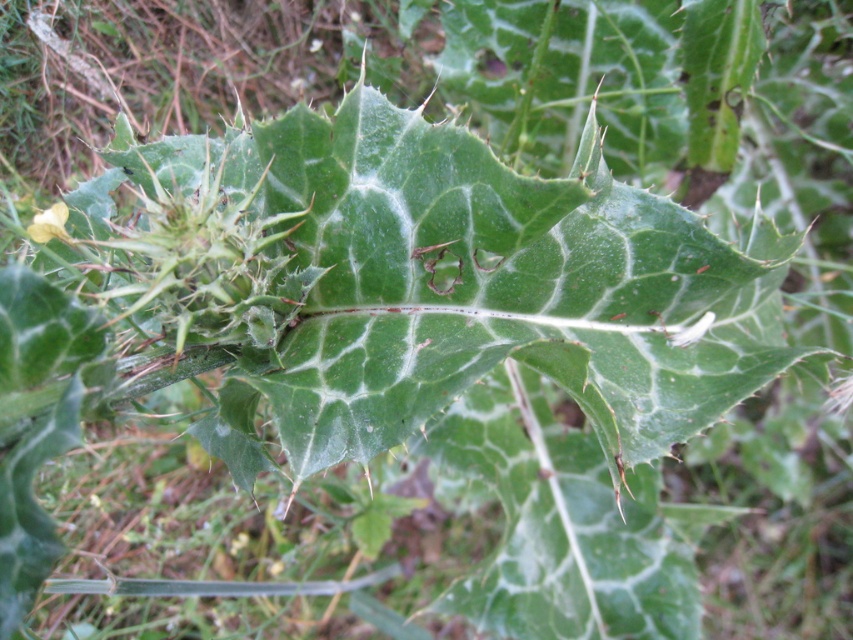
The image size is (853, 640). In order to click on green matte leaf at center in this screenshot , I will do `click(502, 289)`.

This screenshot has height=640, width=853. I want to click on green matte leaf at center, so click(x=502, y=289).

The width and height of the screenshot is (853, 640). Identify the location of green matte leaf at center. (502, 289).